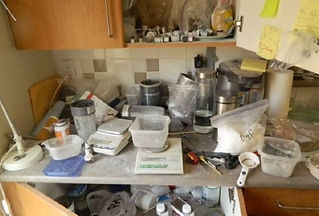
Help me find post it notes in the image by pointing to them. Your answer should be formatted as a list of tuples, i.e. [(x1, y1), (x2, y2), ...], where each tuple contains the x and y coordinates of a point satisfying the conditions above.

[(270, 7), (313, 19), (270, 41), (253, 65)]